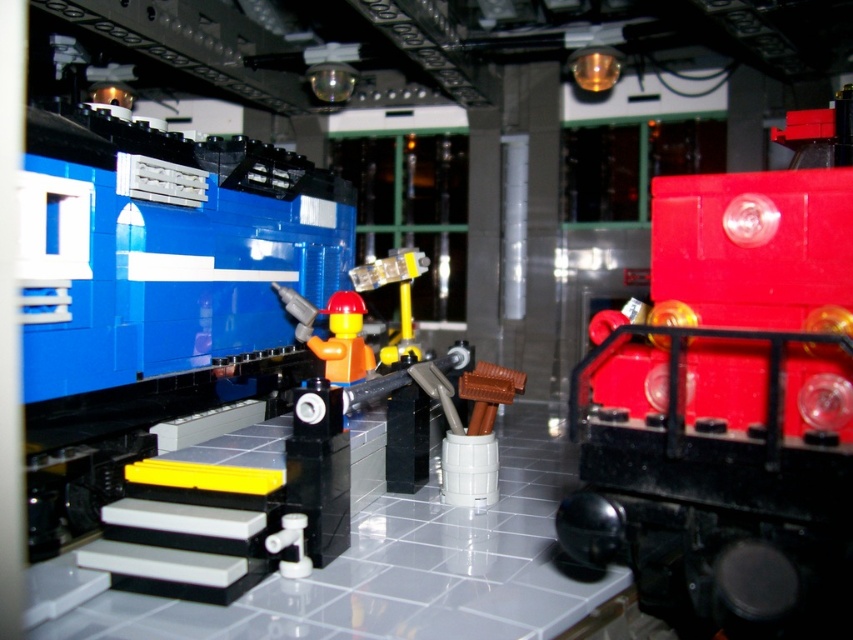
Question: Which of the following is the farthest from the observer?

Choices:
 (A) (380, 278)
 (B) (509, 381)
 (C) (659, 371)
 (D) (370, 349)

Answer: (A)

Question: From the image, what is the correct spatial relationship of shiny red train at right in relation to yellow matte figure at center?

Choices:
 (A) below
 (B) above

Answer: (A)

Question: Which of the following is the closest to the observer?

Choices:
 (A) (451, 458)
 (B) (399, 328)
 (C) (802, 506)

Answer: (C)

Question: Does shiny red train at right appear on the left side of translucent yellow plastic at center?

Choices:
 (A) no
 (B) yes

Answer: (A)

Question: Which of these objects is positioned closest to the translucent yellow plastic at center?

Choices:
 (A) shiny red train at right
 (B) yellow matte figure at center
 (C) brown plastic cup at center

Answer: (B)

Question: Observing the image, what is the correct spatial positioning of brown plastic cup at center in reference to translucent yellow plastic at center?

Choices:
 (A) below
 (B) above

Answer: (A)